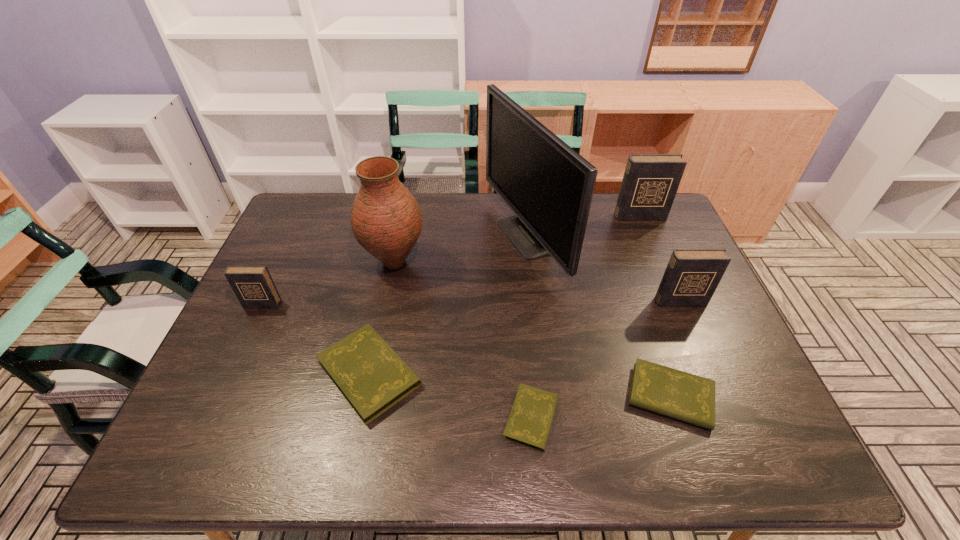
You are a GUI agent. You are given a task and a screenshot of the screen. Output one action in this format:
    pyautogui.click(x=<x>, y=<y>)
    Task: Click on the free space at the left edge
    Image resolution: width=960 pixels, height=540 pixels.
    Given the screenshot: What is the action you would take?
    pyautogui.click(x=269, y=315)

Locate an element on the screen. The width and height of the screenshot is (960, 540). vacant space at the right edge of the desktop is located at coordinates (703, 328).

Find the location of a particular element. The image size is (960, 540). vacant space at the far left corner is located at coordinates (295, 231).

You are a GUI agent. You are given a task and a screenshot of the screen. Output one action in this format:
    pyautogui.click(x=<x>, y=<y>)
    Task: Click on the empty space between the shortest diary and the tallest object
    This screenshot has width=960, height=540.
    Given the screenshot: What is the action you would take?
    pyautogui.click(x=528, y=328)

Identify the location of unoccupied area between the second biggest dark diary and the rightmost green diary. This screenshot has height=540, width=960. (675, 349).

Locate an element on the screen. This screenshot has width=960, height=540. blank region between the fifth tallest diary and the shortest diary is located at coordinates (601, 407).

Locate an element on the screen. The height and width of the screenshot is (540, 960). vacant area between the tallest object and the fifth diary from right to left is located at coordinates (446, 305).

Identify the location of vacant space that's between the vase and the fifth tallest object. (328, 284).

Locate an element on the screen. The width and height of the screenshot is (960, 540). free space between the third diary from left to right and the seventh shortest object is located at coordinates (463, 340).

At what (x,y) coordinates should I click in order to perform the action: click on free spot between the second biggest green diary and the shortest diary. Please return your answer as a coordinate pair (x, y). This screenshot has height=540, width=960. Looking at the image, I should click on (601, 407).